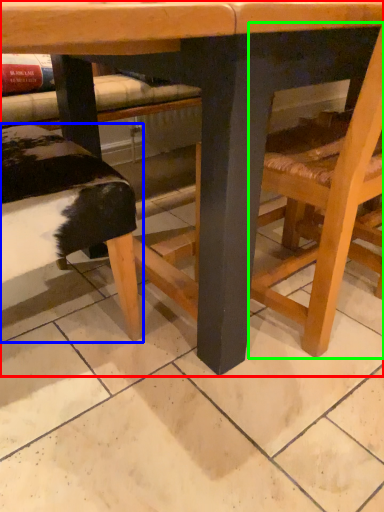
Question: Considering the real-world distances, which object is closest to table (highlighted by a red box)? park bench (highlighted by a blue box) or chair (highlighted by a green box).

Choices:
 (A) park bench
 (B) chair

Answer: (B)